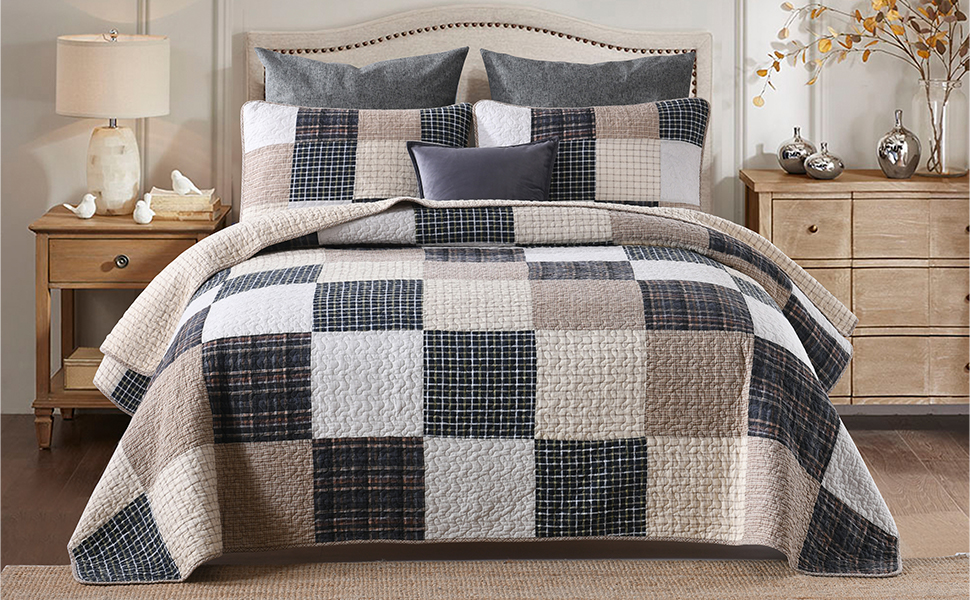
Image resolution: width=970 pixels, height=600 pixels. I want to click on wall, so click(x=30, y=172).